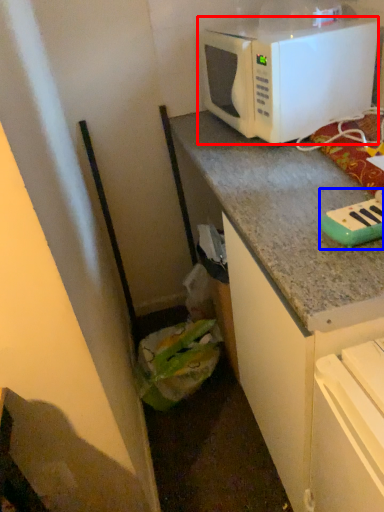
Question: Which of the following is the farthest to the observer, microwave oven (highlighted by a red box) or appliance (highlighted by a blue box)?

Choices:
 (A) microwave oven
 (B) appliance

Answer: (A)